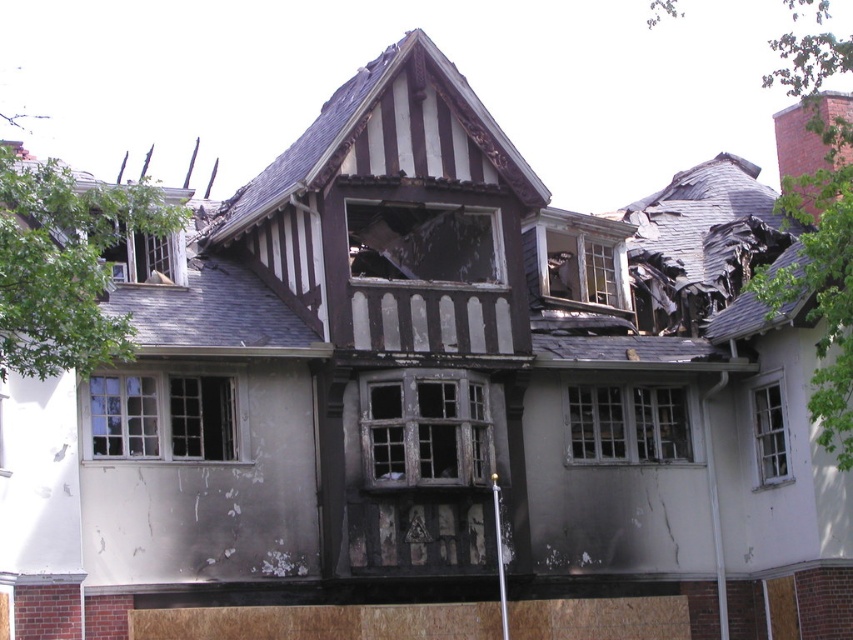
Question: Among these objects, which one is farthest from the camera?

Choices:
 (A) white wooden window at lower left
 (B) charred wood window at center
 (C) transparent glass window at upper left

Answer: (B)

Question: Which point is farther to the camera?

Choices:
 (A) (572, 260)
 (B) (766, 467)
 (C) (140, 252)

Answer: (A)

Question: Does white wooden window at lower left appear under wooden window at center?

Choices:
 (A) no
 (B) yes

Answer: (B)

Question: In this image, where is dark gray wooden window at center located relative to charred wood window at center?

Choices:
 (A) above
 (B) below

Answer: (B)

Question: Where is white wooden window at lower left located in relation to charred wood window at center in the image?

Choices:
 (A) below
 (B) above

Answer: (A)

Question: Among these objects, which one is farthest from the camera?

Choices:
 (A) dark gray wooden window at center
 (B) white wooden window at lower left

Answer: (A)